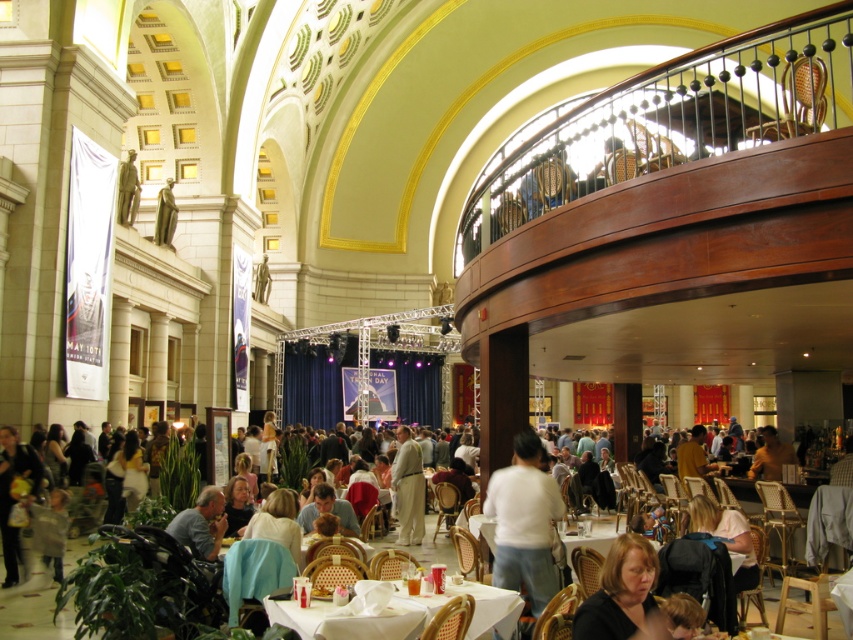
Measure the distance from yellow shirt at center to bronze statue at upper center.

yellow shirt at center and bronze statue at upper center are 52.84 meters apart.

Can you confirm if yellow shirt at center is positioned to the left of bronze statue at upper center?

Incorrect, yellow shirt at center is not on the left side of bronze statue at upper center.

Is point (770, 444) farther from viewer compared to point (164, 212)?

That is False.

Find the location of a particular element. The height and width of the screenshot is (640, 853). yellow shirt at center is located at coordinates (770, 456).

Which is above, white cotton shirt at center or matte bronze statue at upper left?

Positioned higher is matte bronze statue at upper left.

Between white cotton shirt at center and matte bronze statue at upper left, which one appears on the left side from the viewer's perspective?

Positioned to the left is matte bronze statue at upper left.

The width and height of the screenshot is (853, 640). Find the location of `white cotton shirt at center`. white cotton shirt at center is located at coordinates (524, 522).

Who is shorter, blonde hair at lower center or light beige fabric suit at center?

With less height is blonde hair at lower center.

Looking at this image, can you confirm if blonde hair at lower center is thinner than light beige fabric suit at center?

No, blonde hair at lower center is not thinner than light beige fabric suit at center.

Which is in front, point (635, 532) or point (408, 444)?

Point (635, 532)

You are a GUI agent. You are given a task and a screenshot of the screen. Output one action in this format:
    pyautogui.click(x=<x>, y=<y>)
    Task: Click on the blonde hair at lower center
    The width and height of the screenshot is (853, 640).
    Given the screenshot: What is the action you would take?
    pyautogui.click(x=624, y=595)